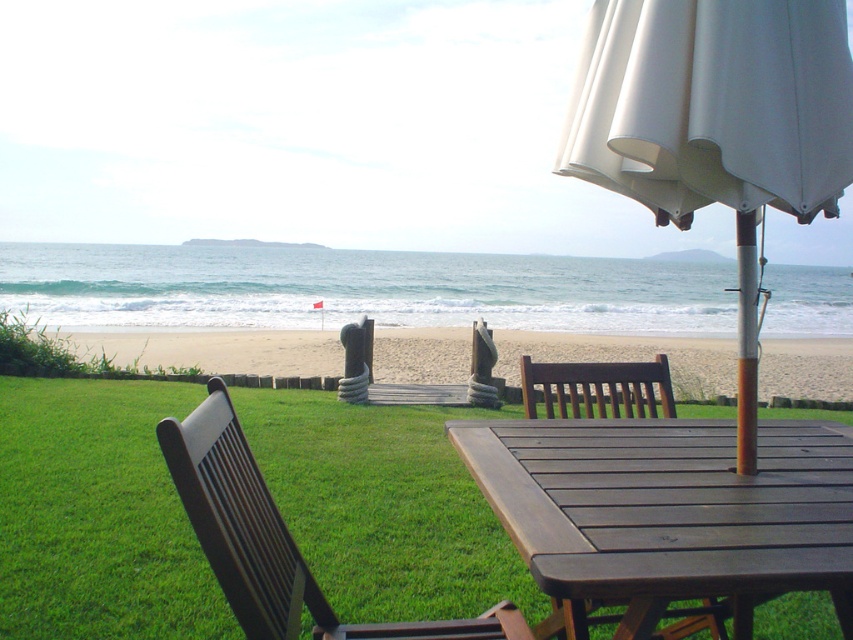
Question: Can you confirm if brown wood chair at lower left is positioned to the left of dark brown wood chair at center?

Choices:
 (A) no
 (B) yes

Answer: (B)

Question: Which is farther from the brown wood bench at center?

Choices:
 (A) beige sand at center
 (B) white fabric umbrella at upper right

Answer: (A)

Question: Among these points, which one is farthest from the camera?

Choices:
 (A) (753, 13)
 (B) (547, 408)
 (C) (566, 307)

Answer: (C)

Question: Can you confirm if white fabric umbrella at upper right is thinner than blue water at center?

Choices:
 (A) yes
 (B) no

Answer: (A)

Question: Which point is farther to the camera?

Choices:
 (A) (686, 432)
 (B) (532, 385)

Answer: (B)

Question: Is dark brown wood table at center thinner than beige sand at center?

Choices:
 (A) no
 (B) yes

Answer: (B)